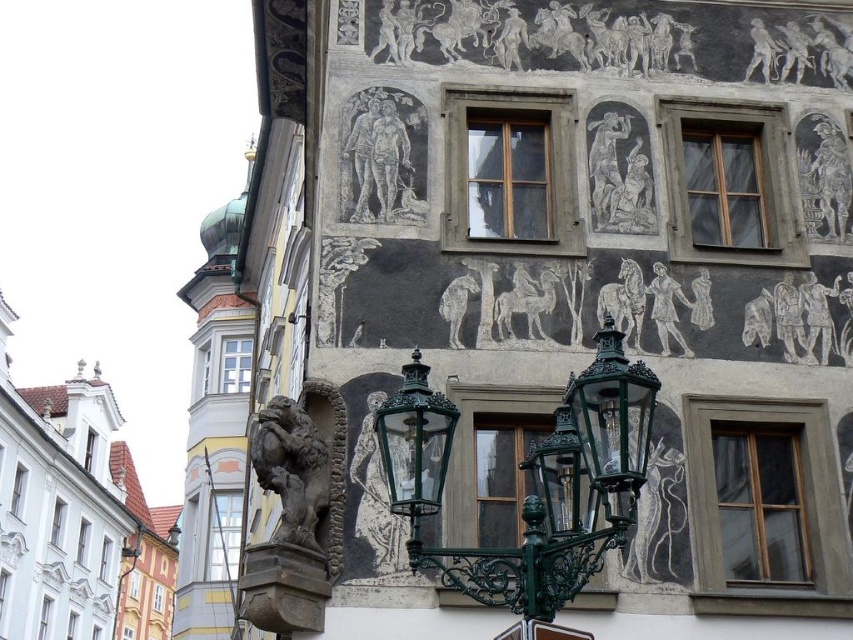
Question: Which is nearer to the dark stone lion at lower left?

Choices:
 (A) gray stone figure at center
 (B) green wrought iron streetlight at center
 (C) gray stone statue at upper right
 (D) gray stone relief at upper right

Answer: (B)

Question: Observing the image, what is the correct spatial positioning of white marble horse at upper center in reference to gray stone statue at upper right?

Choices:
 (A) below
 (B) above

Answer: (A)

Question: Can you confirm if white marble horse at upper center is smaller than gray stone figure at center?

Choices:
 (A) no
 (B) yes

Answer: (A)

Question: Considering the real-world distances, which object is closest to the dark stone lion at lower left?

Choices:
 (A) green wrought iron streetlight at center
 (B) black stone relief at upper right
 (C) gray stone statue at upper right
 (D) gray stone figure at center

Answer: (A)

Question: Which object is the farthest from the gray stone figure at center?

Choices:
 (A) dark stone lion at lower left
 (B) green wrought iron streetlight at center
 (C) gray stone relief of couple at center

Answer: (A)

Question: Can you confirm if green wrought iron streetlight at center is positioned below gray stone relief of couple at center?

Choices:
 (A) no
 (B) yes

Answer: (B)